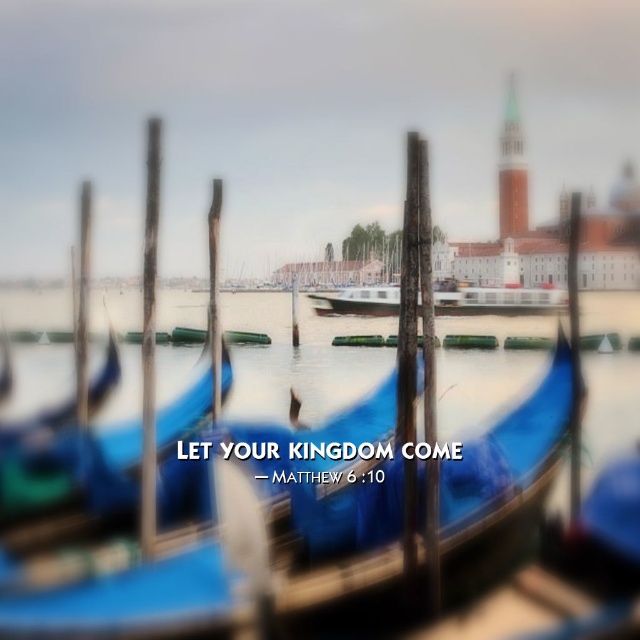
Which is below, blue polished wood gondola at center or white glossy boat at center?

Positioned lower is blue polished wood gondola at center.

The height and width of the screenshot is (640, 640). What do you see at coordinates (248, 513) in the screenshot?
I see `blue polished wood gondola at center` at bounding box center [248, 513].

Find the location of a particular element. The width and height of the screenshot is (640, 640). blue polished wood gondola at center is located at coordinates (248, 513).